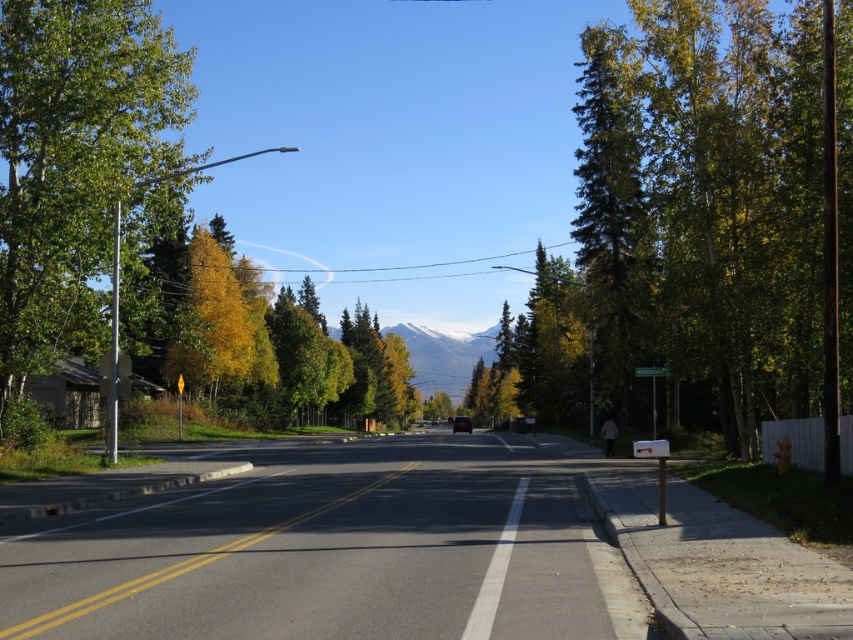
Based on the photo, you are a delivery person driving a truck that is 2 meters wide. You need to pass through the space between the green leafy tree at left and the green plastic street sign at center. Can your truck fit through that space?

The green leafy tree at left might be wider than green plastic street sign at center, so the space between them may not be wide enough for a 2 meter wide truck. It is uncertain and requires further measurement.